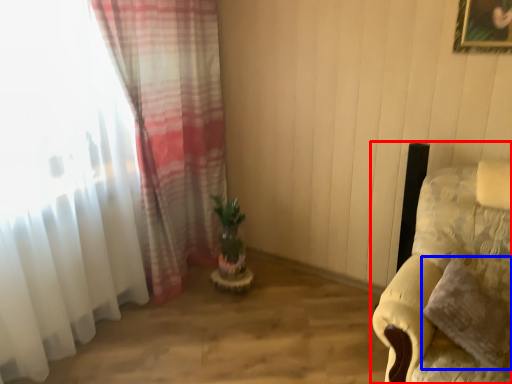
Question: Which point is further to the camera, furniture (highlighted by a red box) or pillow (highlighted by a blue box)?

Choices:
 (A) furniture
 (B) pillow

Answer: (B)